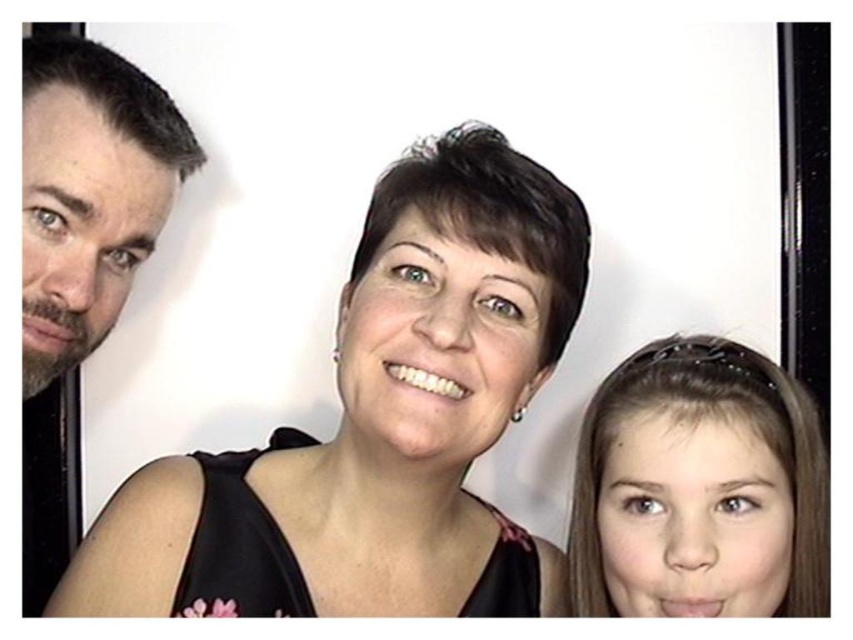
Looking at this image, between black fabric at center and smooth brown hair at lower right, which one appears on the left side from the viewer's perspective?

Positioned to the left is black fabric at center.

Does black fabric at center lie behind smooth brown hair at lower right?

No, it is not.

Is point (548, 595) positioned behind point (781, 570)?

Yes, it is.

At what (x,y) coordinates should I click in order to perform the action: click on black fabric at center. Please return your answer as a coordinate pair (x, y). Image resolution: width=853 pixels, height=640 pixels. Looking at the image, I should click on (386, 401).

Is point (432, 438) more distant than point (33, 211)?

Yes, it is behind point (33, 211).

Can you confirm if black fabric at center is positioned below dark brown hair at left?

Indeed, black fabric at center is positioned under dark brown hair at left.

Is point (465, 326) in front of point (45, 109)?

No, it is behind (45, 109).

Identify the location of black fabric at center. (386, 401).

How much distance is there between smooth brown hair at lower right and dark brown hair at left?

smooth brown hair at lower right and dark brown hair at left are 18.41 inches apart.

Consider the image. Is smooth brown hair at lower right bigger than dark brown hair at left?

Yes, smooth brown hair at lower right is bigger than dark brown hair at left.

Between point (776, 560) and point (142, 140), which one is positioned in front?

Point (142, 140)

Where is `smooth brown hair at lower right`? Image resolution: width=853 pixels, height=640 pixels. smooth brown hair at lower right is located at coordinates (699, 488).